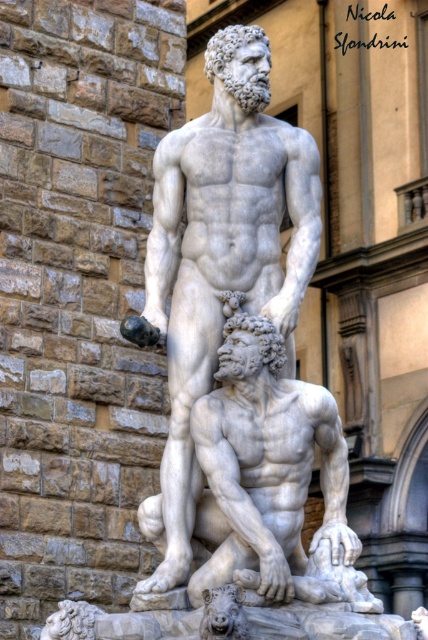
You are an art curator planning to move the white marble statue at center and the white marble man at center into a new exhibition hall. The hall has a 20 feet wide entrance. Can both objects be moved through the entrance simultaneously without any modifications?

The white marble statue at center is 19.89 feet from the white marble man at center, so the total width required to move both objects side by side would be approximately 19.89 feet. Since the entrance is 20 feet wide, there is enough space to move both objects through the entrance simultaneously without any modifications.

Looking at this image, you are an art student standing in front of the sculpture. You need to describe the positions of the white marble statue at center and the white marble man at center relative to each other. Which one is on the left side?

The white marble statue at center is to the left of the white marble man at center.